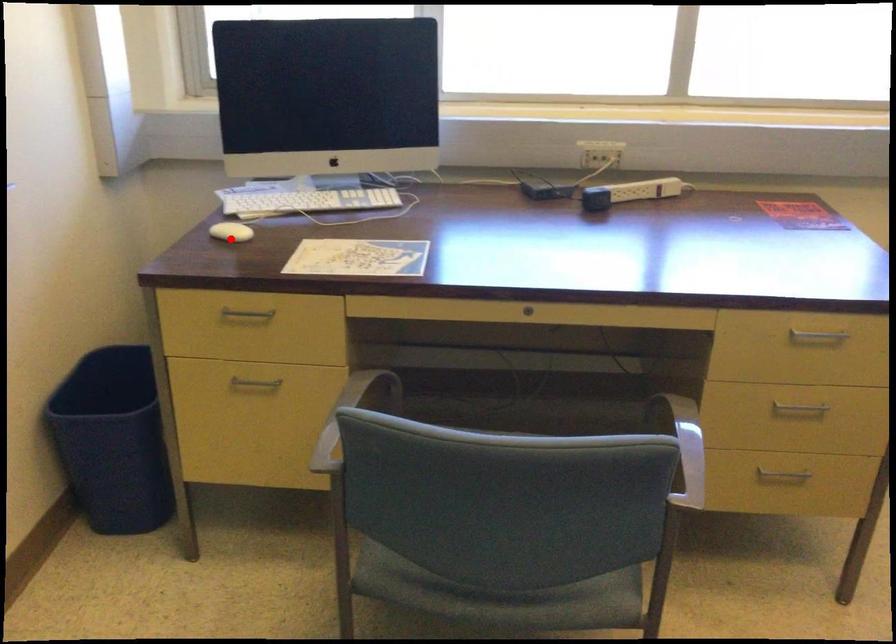
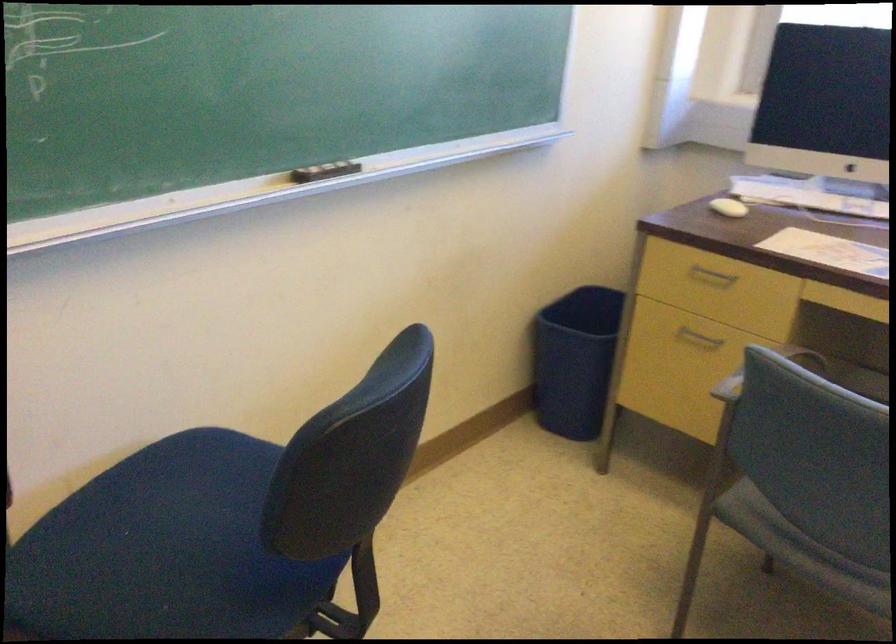
Question: I am providing you with two images of the same scene from different viewpoints. Given a red point in image1, look at the same physical point in image2. Is it:

Choices:
 (A) Closer to the viewpoint
 (B) Farther from the viewpoint

Answer: (B)